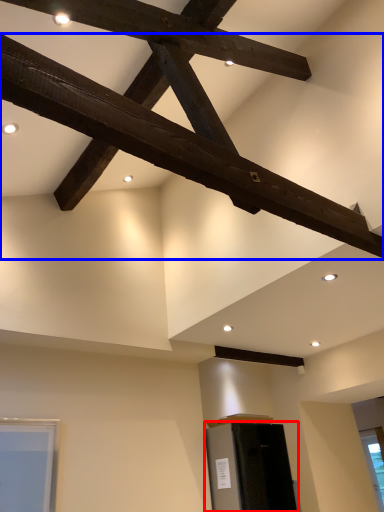
Question: Which object appears closest to the camera in this image, furniture (highlighted by a red box) or beam (highlighted by a blue box)?

Choices:
 (A) furniture
 (B) beam

Answer: (B)